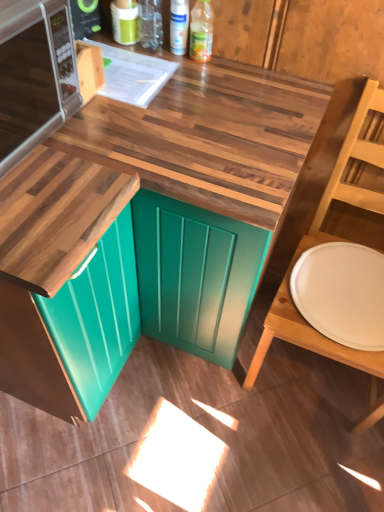
Question: From their relative heights in the image, would you say teal glossy cabinet at lower left is taller or shorter than wooden at center?

Choices:
 (A) tall
 (B) short

Answer: (A)

Question: Is teal glossy cabinet at lower left to the left or to the right of wooden at center in the image?

Choices:
 (A) right
 (B) left

Answer: (B)

Question: Based on their relative distances, which object is nearer to the wooden chair at right?

Choices:
 (A) white matte plate at right
 (B) silver metallic microwave at upper left
 (C) white glossy spray can at upper center, which appears as the first bottle when viewed from the left
 (D) wooden at center
 (E) teal glossy cabinet at lower left

Answer: (A)

Question: Which of these objects is positioned farthest from the white matte plate at right?

Choices:
 (A) teal glossy cabinet at lower left
 (B) wooden chair at right
 (C) translucent plastic bottle at upper center, which is the second bottle in left-to-right order
 (D) wooden at center
 (E) white glossy spray can at upper center, positioned as the second bottle in right-to-left order

Answer: (E)